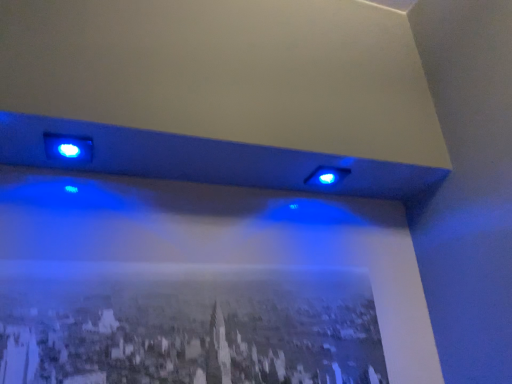
This screenshot has height=384, width=512. Describe the element at coordinates (68, 148) in the screenshot. I see `blue plastic stage light at upper left` at that location.

At what (x,y) coordinates should I click in order to perform the action: click on blue plastic stage light at upper left. Please return your answer as a coordinate pair (x, y). The height and width of the screenshot is (384, 512). Looking at the image, I should click on (68, 148).

This screenshot has width=512, height=384. In order to click on blue plastic stage light at upper left in this screenshot , I will do click(x=68, y=148).